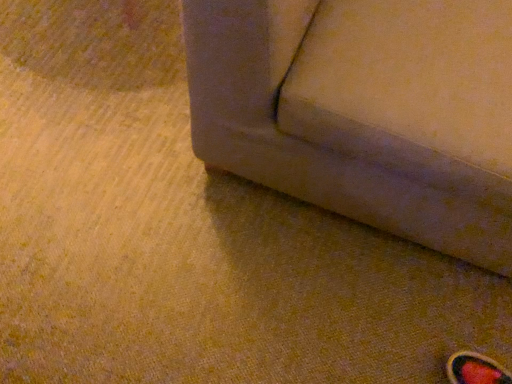
Where is `matte white couch at lower center`? This screenshot has width=512, height=384. matte white couch at lower center is located at coordinates (310, 145).

What is the approximate width of matte white couch at lower center?

36.62 inches.

The image size is (512, 384). What do you see at coordinates (310, 145) in the screenshot?
I see `matte white couch at lower center` at bounding box center [310, 145].

You are a GUI agent. You are given a task and a screenshot of the screen. Output one action in this format:
    pyautogui.click(x=<x>, y=<y>)
    Task: Click on the matte white couch at lower center
    The width and height of the screenshot is (512, 384).
    Given the screenshot: What is the action you would take?
    pyautogui.click(x=310, y=145)